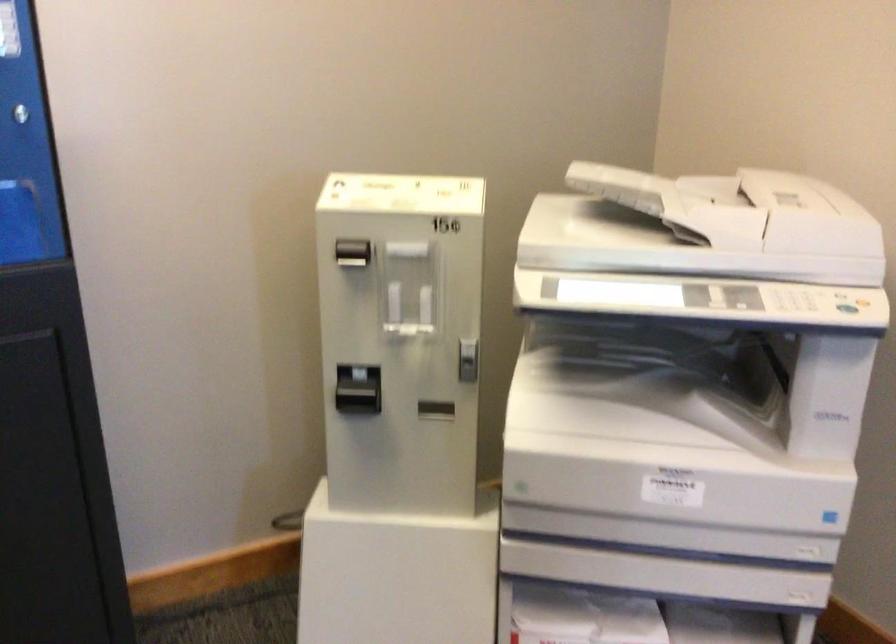
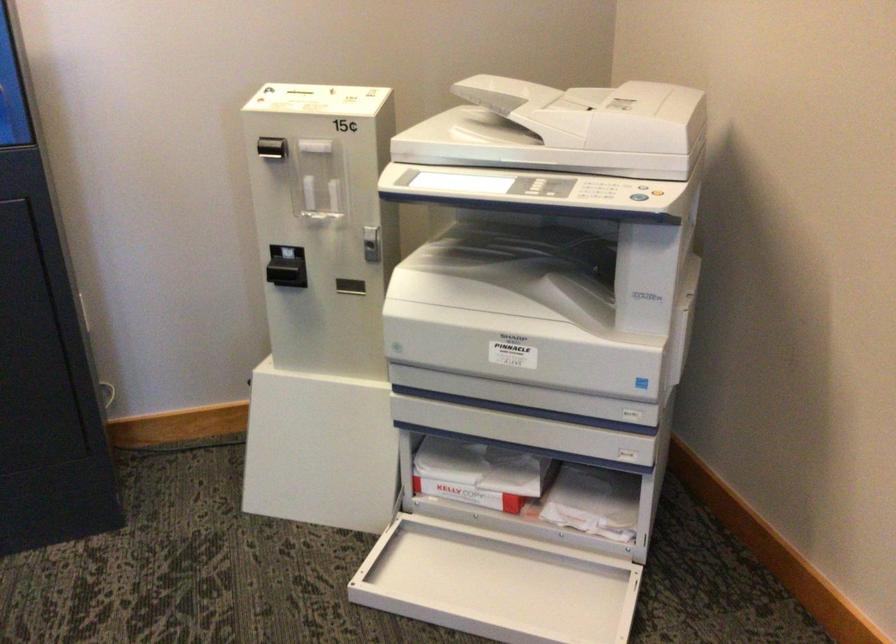
In the second image, find the point that corresponds to point 352,254 in the first image.

(271, 147)